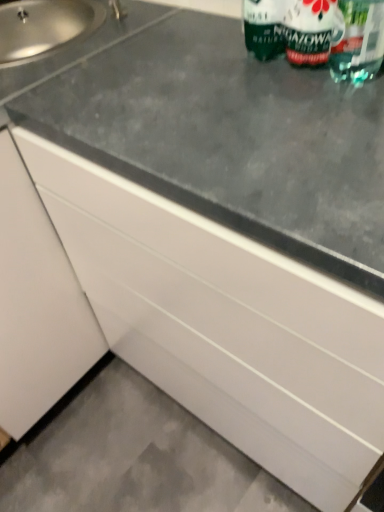
Question: From their relative heights in the image, would you say satin steel sink at upper left is taller or shorter than green matte bottle at upper right?

Choices:
 (A) short
 (B) tall

Answer: (A)

Question: Is point (135, 31) positioned closer to the camera than point (379, 18)?

Choices:
 (A) farther
 (B) closer

Answer: (A)

Question: Based on their relative distances, which object is nearer to the silver metallic faucet at upper left?

Choices:
 (A) green matte bottle at upper right
 (B) gray concrete at lower left
 (C) transparent plastic straw at upper right
 (D) satin steel sink at upper left

Answer: (D)

Question: Which object is positioned closest to the green matte bottle at upper right?

Choices:
 (A) transparent plastic straw at upper right
 (B) silver metallic faucet at upper left
 (C) gray concrete at lower left
 (D) satin steel sink at upper left

Answer: (A)